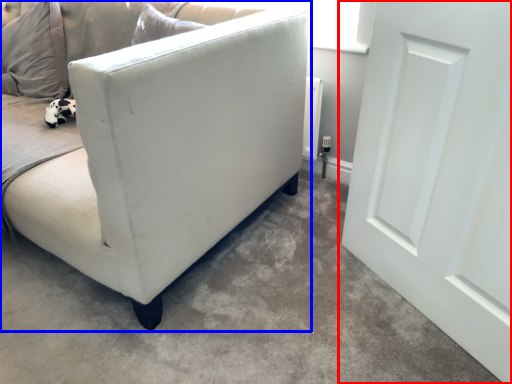
Question: Which object is closer to the camera taking this photo, door (highlighted by a red box) or studio couch (highlighted by a blue box)?

Choices:
 (A) door
 (B) studio couch

Answer: (A)